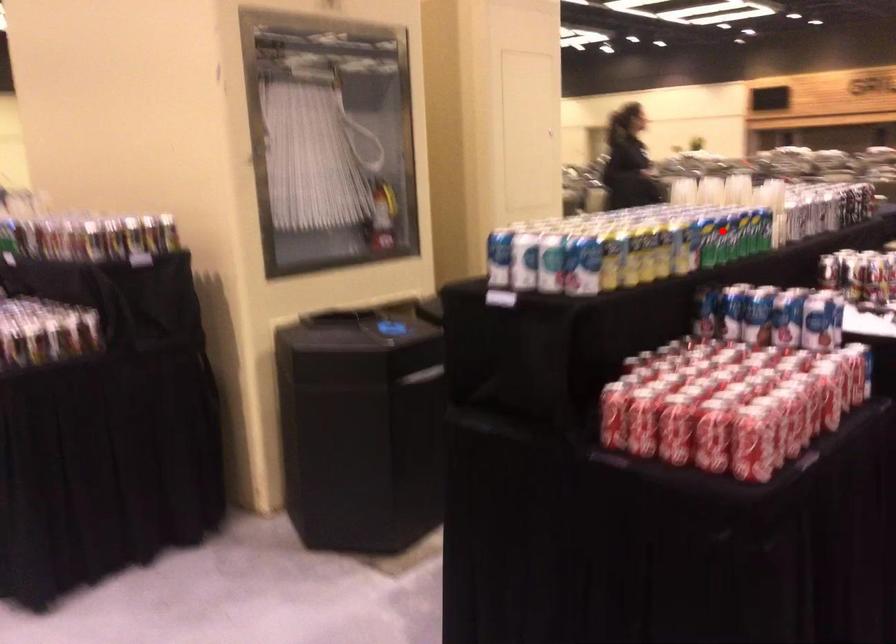
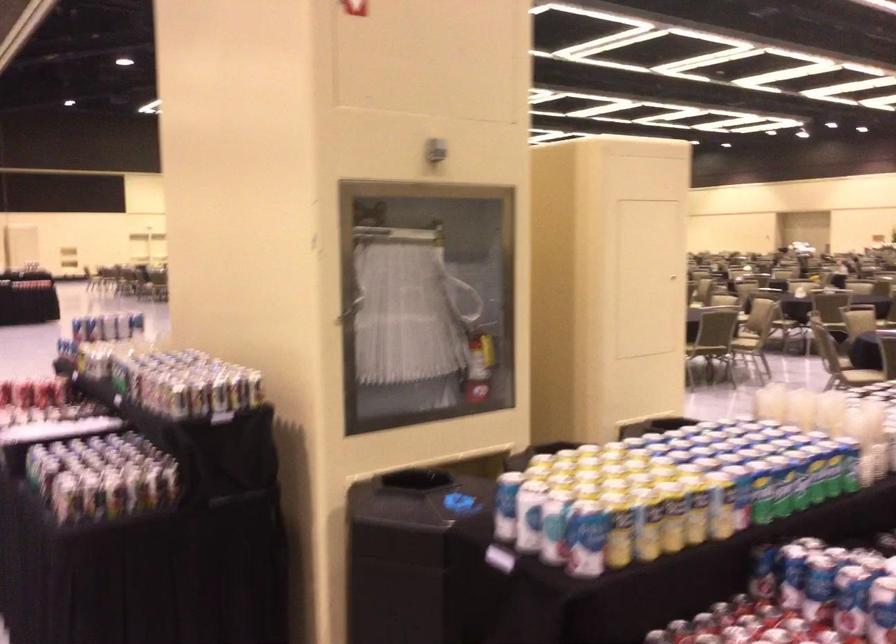
Locate, in the second image, the point that corresponds to the highlighted location in the first image.

(780, 486)